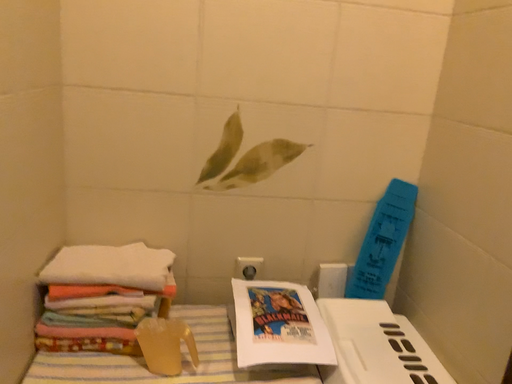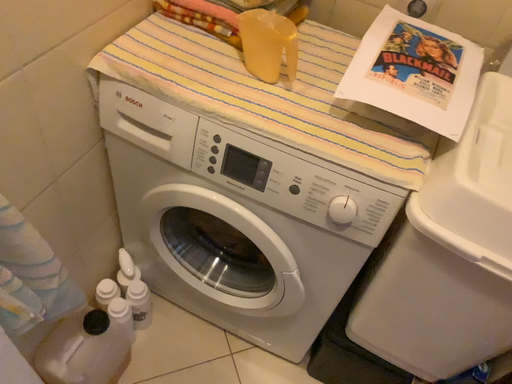
Question: How did the camera likely rotate when shooting the video?

Choices:
 (A) rotated downward
 (B) rotated upward

Answer: (A)